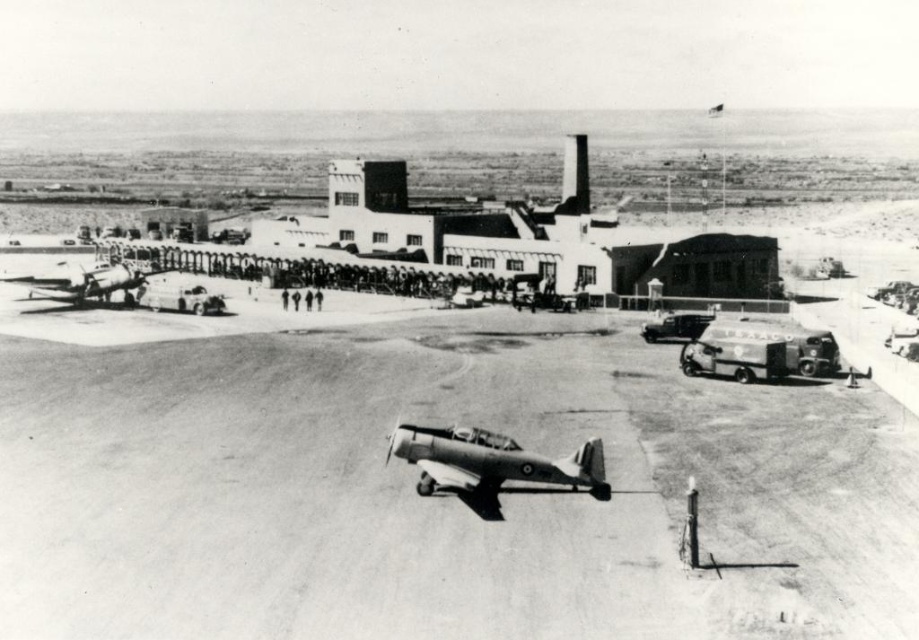
Can you confirm if smooth asphalt tarmac at center is taller than metallic silver airplane at left?

Incorrect, smooth asphalt tarmac at center's height is not larger of metallic silver airplane at left's.

Does smooth asphalt tarmac at center have a larger size compared to metallic silver airplane at left?

Correct, smooth asphalt tarmac at center is larger in size than metallic silver airplane at left.

At what (x,y) coordinates should I click in order to perform the action: click on smooth asphalt tarmac at center. Please return your answer as a coordinate pair (x, y). Looking at the image, I should click on (437, 497).

Is point (268, 508) positioned in front of point (391, 440)?

Yes, it is in front of point (391, 440).

Is point (94, 506) farther from camera compared to point (403, 458)?

No, (94, 506) is closer to viewer.

Where is `smooth asphalt tarmac at center`? The image size is (919, 640). smooth asphalt tarmac at center is located at coordinates (437, 497).

Does metallic gray airplane at center have a smaller size compared to metallic silver airplane at left?

Indeed, metallic gray airplane at center has a smaller size compared to metallic silver airplane at left.

Is point (424, 467) closer to camera compared to point (93, 285)?

That is True.

Is point (401, 436) less distant than point (128, 284)?

Yes, it is.

Identify the location of metallic gray airplane at center. Image resolution: width=919 pixels, height=640 pixels. (491, 460).